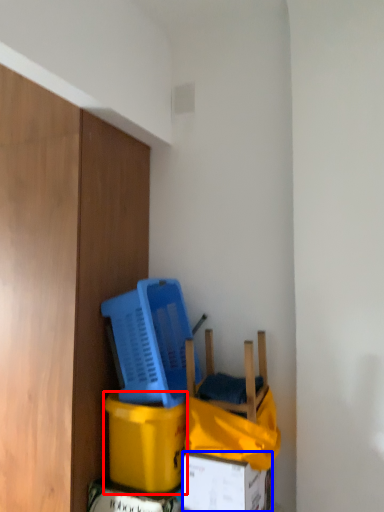
Question: Which point is further to the camera, cardboard box (highlighted by a red box) or box (highlighted by a blue box)?

Choices:
 (A) cardboard box
 (B) box

Answer: (A)